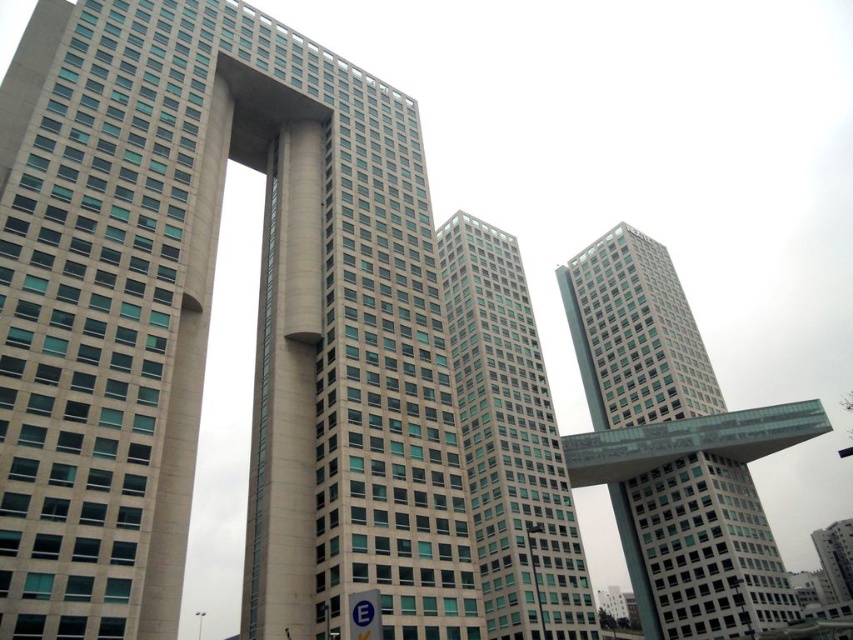
You are standing in front of the modern highrise buildings and see two points marked on the bridge between them. The points are labeled as point (422, 458) and point (585, 321). Which point is closer to your current position?

Point (422, 458) is closer to the viewer than point (585, 321), so the point labeled (422, 458) is closer to your current position.

You are an architect analyzing the layout of the scene. Based on the coordinates provided, where is the beige concrete building at center located in the image?

The beige concrete building at center is located at the coordinates point (207, 326).